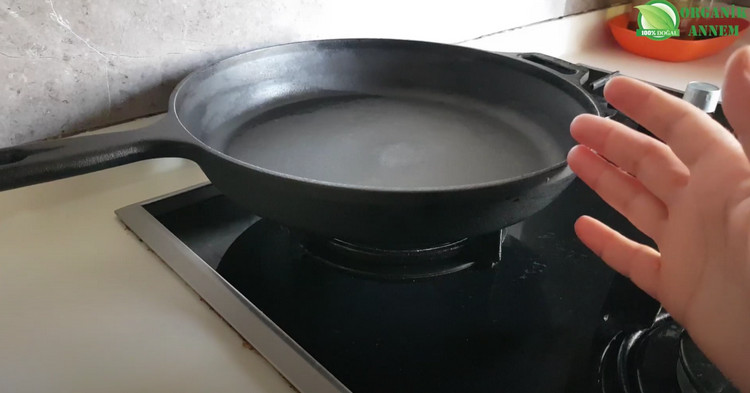
I want to click on left silver edge of stove, so click(x=199, y=277), click(x=306, y=380).